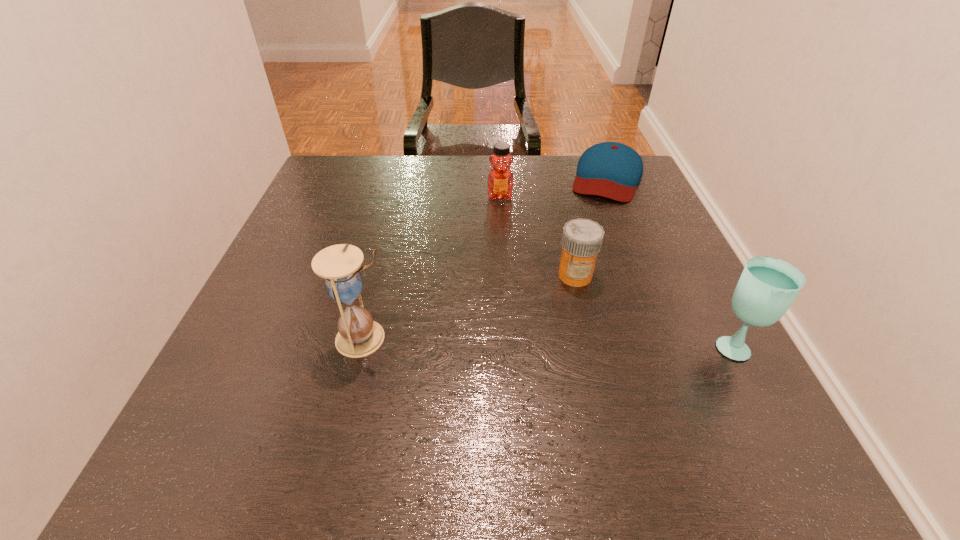
Identify the location of baseball cap present at the far edge. The height and width of the screenshot is (540, 960). (613, 170).

I want to click on glass situated at the right edge, so click(768, 286).

You are a GUI agent. You are given a task and a screenshot of the screen. Output one action in this format:
    pyautogui.click(x=<x>, y=<y>)
    Task: Click on the baseball cap present at the right edge
    The image size is (960, 540).
    Given the screenshot: What is the action you would take?
    pyautogui.click(x=613, y=170)

Identify the location of object present at the far right corner. The height and width of the screenshot is (540, 960). (613, 170).

In the image, there is a desktop. Where is `vacant space at the far edge`? Image resolution: width=960 pixels, height=540 pixels. vacant space at the far edge is located at coordinates (517, 179).

In the image, there is a desktop. In order to click on free space at the near edge in this screenshot , I will do `click(500, 400)`.

The width and height of the screenshot is (960, 540). What are the coordinates of `vacant area at the left edge of the desktop` in the screenshot? It's located at (284, 354).

This screenshot has width=960, height=540. I want to click on free space at the right edge of the desktop, so click(x=704, y=366).

In the image, there is a desktop. At what (x,y) coordinates should I click in order to perform the action: click on vacant space at the far left corner. Please return your answer as a coordinate pair (x, y). The image size is (960, 540). Looking at the image, I should click on (352, 167).

Locate an element on the screen. vacant space at the near right corner is located at coordinates (689, 379).